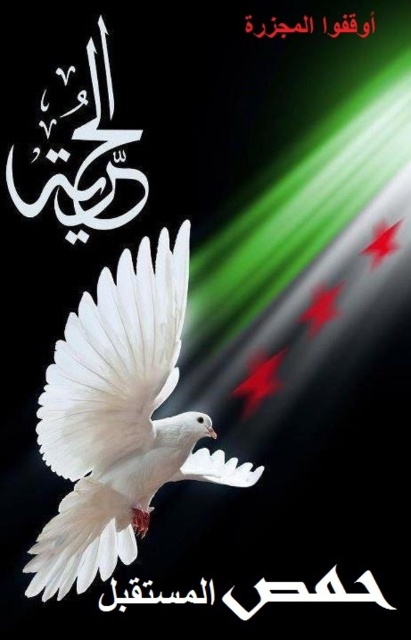
You are an art curator preparing to display this image. You need to ensure that the matte white dove at center and the black calligraphy at center are both clearly visible. Given their sizes, which object might require additional lighting to ensure it stands out?

The black calligraphy at center might require additional lighting to ensure it stands out because it is smaller than the matte white dove at center.

Based on the scene described, which object is closer to the viewer between the matte white dove at center and the black calligraphy at center?

The matte white dove at center is closer to the viewer than the black calligraphy at center.

You are a photographer standing 6 feet away from the camera. You want to take a photo of the matte white dove at center. Can you reach the dove to adjust its position if you can extend your arm 1 foot further than your current distance?

The matte white dove at center is 5.37 feet away from the camera. Since you are 6 feet away from the camera, you are farther than the dove. Extending your arm 1 foot further would put you at 7 feet, which is even farther. Therefore, you cannot reach the dove.